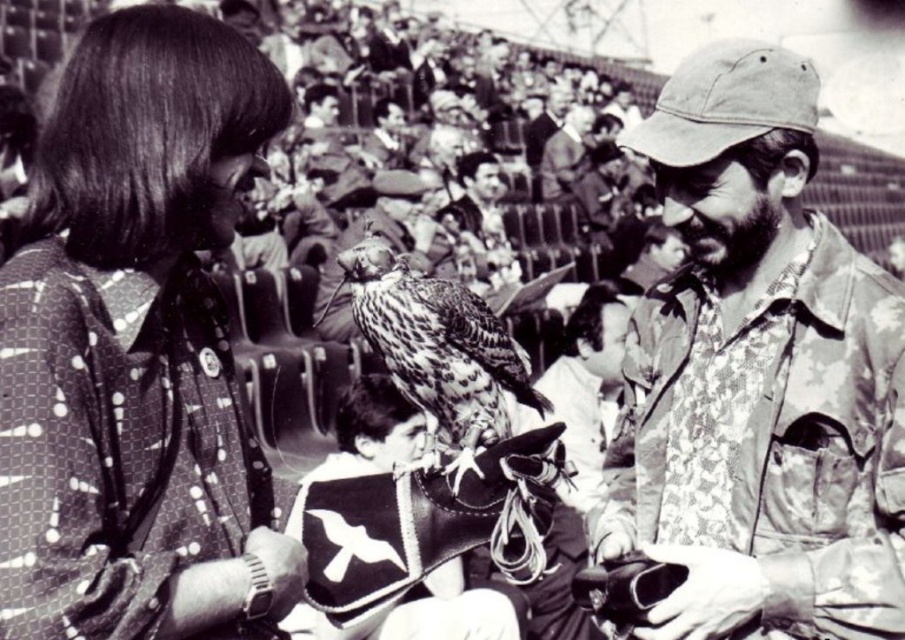
Question: Does polka dot fabric shirt at upper left have a greater width compared to leather vest at center?

Choices:
 (A) yes
 (B) no

Answer: (B)

Question: From the image, what is the correct spatial relationship of speckled feathers falcon at center in relation to leather vest at center?

Choices:
 (A) above
 (B) below

Answer: (A)

Question: Which of the following is the closest to the observer?

Choices:
 (A) click(x=508, y=372)
 (B) click(x=486, y=596)

Answer: (A)

Question: Is speckled feathers falcon at center thinner than leather vest at center?

Choices:
 (A) no
 (B) yes

Answer: (B)

Question: Which object is closer to the camera taking this photo?

Choices:
 (A) floral-patterned shirt at center
 (B) polka dot fabric shirt at upper left

Answer: (B)

Question: Estimate the real-world distances between objects in this image. Which object is farther from the polka dot fabric shirt at upper left?

Choices:
 (A) speckled feathers falcon at center
 (B) floral-patterned shirt at center

Answer: (B)